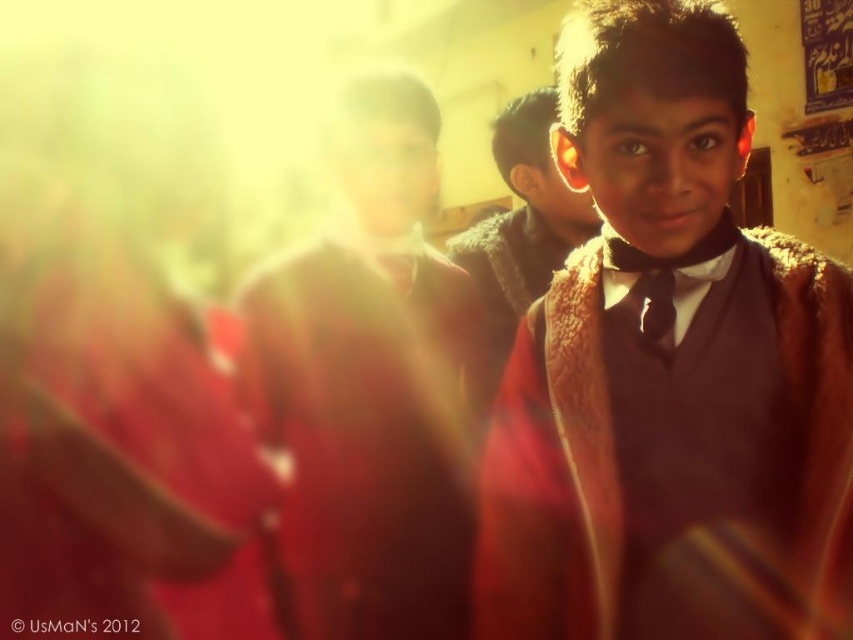
Question: Which object is the closest to the brown woolen sweater at center?

Choices:
 (A) black satin tie at center
 (B) matte red robe at center
 (C) brown fuzzy coat at center

Answer: (A)

Question: Which of these objects is positioned farthest from the brown fuzzy coat at center?

Choices:
 (A) black satin tie at center
 (B) brown woolen sweater at center

Answer: (A)

Question: Can you confirm if brown woolen sweater at center is positioned above brown fuzzy coat at center?

Choices:
 (A) yes
 (B) no

Answer: (B)

Question: Among these points, which one is nearest to the camera?

Choices:
 (A) (750, 280)
 (B) (662, 280)
 (C) (357, 412)
 (D) (534, 275)

Answer: (B)

Question: Can you confirm if brown woolen sweater at center is positioned above brown fuzzy coat at center?

Choices:
 (A) no
 (B) yes

Answer: (A)

Question: Does brown woolen sweater at center appear on the left side of brown fuzzy coat at center?

Choices:
 (A) yes
 (B) no

Answer: (B)